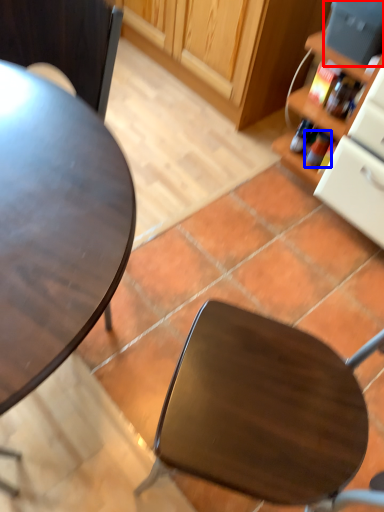
Question: Which object is further to the camera taking this photo, appliance (highlighted by a red box) or bottle (highlighted by a blue box)?

Choices:
 (A) appliance
 (B) bottle

Answer: (B)